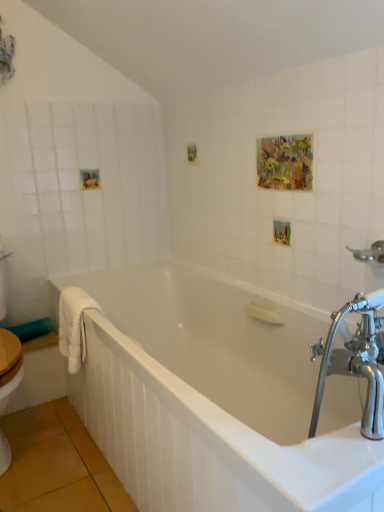
Question: Is white fluffy towel at left taller than chrome metallic showerhead at upper right?

Choices:
 (A) yes
 (B) no

Answer: (A)

Question: Could chrome metallic showerhead at upper right be considered to be inside white fluffy towel at left?

Choices:
 (A) no
 (B) yes

Answer: (A)

Question: Is white fluffy towel at left oriented away from chrome metallic showerhead at upper right?

Choices:
 (A) no
 (B) yes

Answer: (A)

Question: Can you confirm if white fluffy towel at left is bigger than chrome metallic showerhead at upper right?

Choices:
 (A) no
 (B) yes

Answer: (B)

Question: Is white fluffy towel at left located outside chrome metallic showerhead at upper right?

Choices:
 (A) yes
 (B) no

Answer: (A)

Question: From the image's perspective, relative to white fluffy towel at left, is white glossy bathtub at center above or below?

Choices:
 (A) above
 (B) below

Answer: (B)

Question: Considering the positions of white glossy bathtub at center and white fluffy towel at left in the image, is white glossy bathtub at center bigger or smaller than white fluffy towel at left?

Choices:
 (A) small
 (B) big

Answer: (B)

Question: Is point (231, 376) closer or farther from the camera than point (82, 326)?

Choices:
 (A) farther
 (B) closer

Answer: (A)

Question: From a real-world perspective, relative to white fluffy towel at left, is white glossy bathtub at center vertically above or below?

Choices:
 (A) above
 (B) below

Answer: (B)

Question: From the image's perspective, is white fluffy towel at left positioned above or below white glossy bathtub at center?

Choices:
 (A) below
 (B) above

Answer: (B)

Question: Does point (82, 331) appear closer or farther from the camera than point (230, 331)?

Choices:
 (A) farther
 (B) closer

Answer: (B)

Question: From a real-world perspective, is white fluffy towel at left physically located above or below white glossy bathtub at center?

Choices:
 (A) below
 (B) above

Answer: (B)

Question: Is white fluffy towel at left taller or shorter than white glossy bathtub at center?

Choices:
 (A) tall
 (B) short

Answer: (B)

Question: Relative to white glossy bathtub at center, is chrome metallic showerhead at upper right in front or behind?

Choices:
 (A) behind
 (B) front

Answer: (A)

Question: Which is correct: chrome metallic showerhead at upper right is inside white glossy bathtub at center, or outside of it?

Choices:
 (A) inside
 (B) outside

Answer: (B)